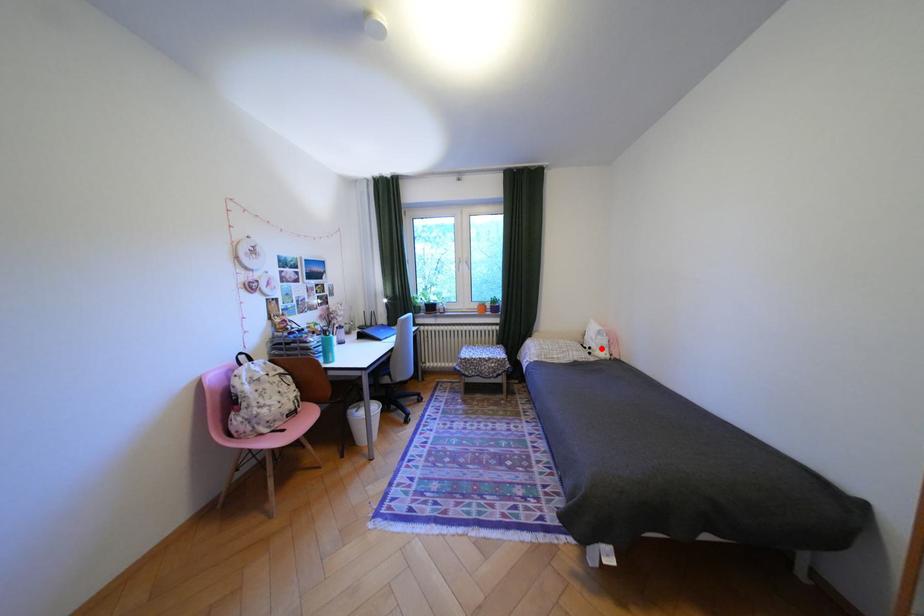
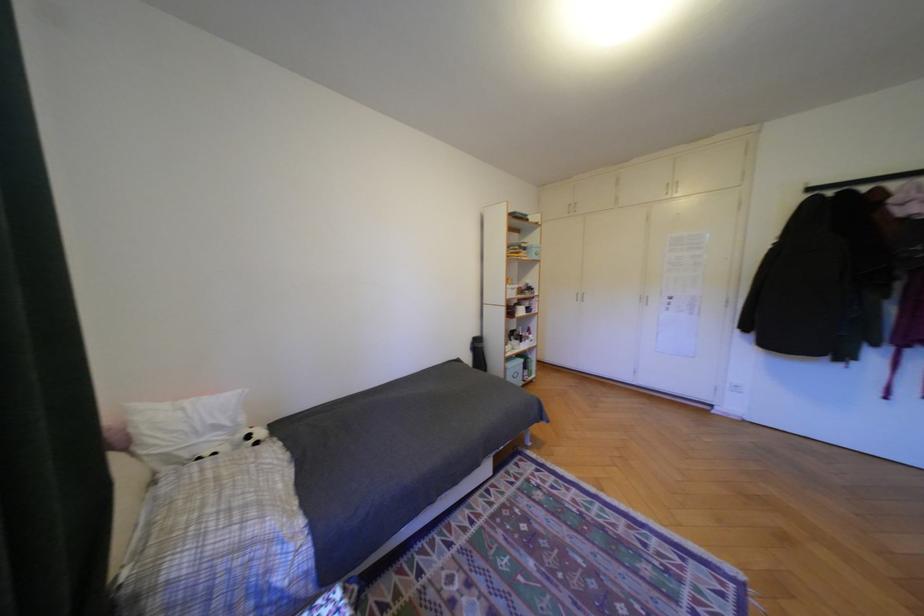
Find the pixel in the second image that matches the highlighted location in the first image.

(261, 437)